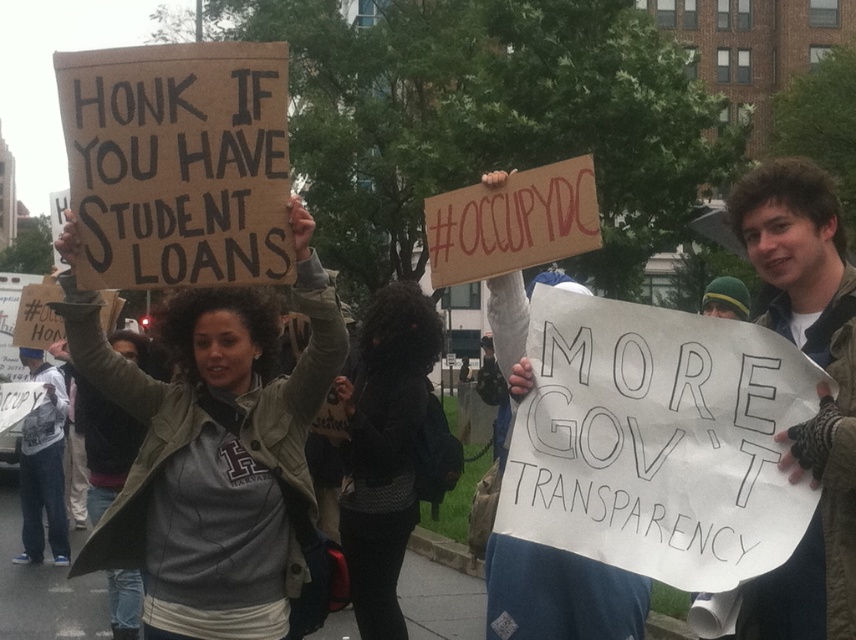
Question: Which object appears closest to the camera in this image?

Choices:
 (A) gray fabric jacket at center
 (B) white paper sign at left
 (C) matte cardboard sign at upper left
 (D) black fabric at center

Answer: (C)

Question: Which point is farther from the camera taking this photo?

Choices:
 (A) (385, 531)
 (B) (818, 216)

Answer: (A)

Question: Is brown leather jacket at upper right bigger than black fabric at center?

Choices:
 (A) no
 (B) yes

Answer: (A)

Question: Which point is farther to the camera?

Choices:
 (A) (777, 240)
 (B) (31, 410)
 (C) (119, 442)
 (D) (296, 304)

Answer: (B)

Question: Does matte cardboard sign at upper left appear over white paper sign at left?

Choices:
 (A) no
 (B) yes

Answer: (B)

Question: Does brown leather jacket at upper right appear under black fabric at center?

Choices:
 (A) no
 (B) yes

Answer: (B)